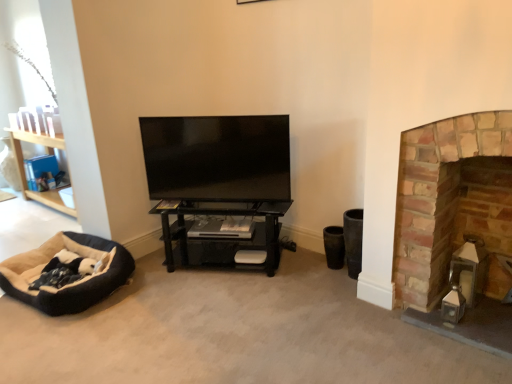
You are a GUI agent. You are given a task and a screenshot of the screen. Output one action in this format:
    pyautogui.click(x=<x>, y=<y>)
    Task: Click on the vacant space to the left of brick fireplace at right
    
    Given the screenshot: What is the action you would take?
    pyautogui.click(x=378, y=328)